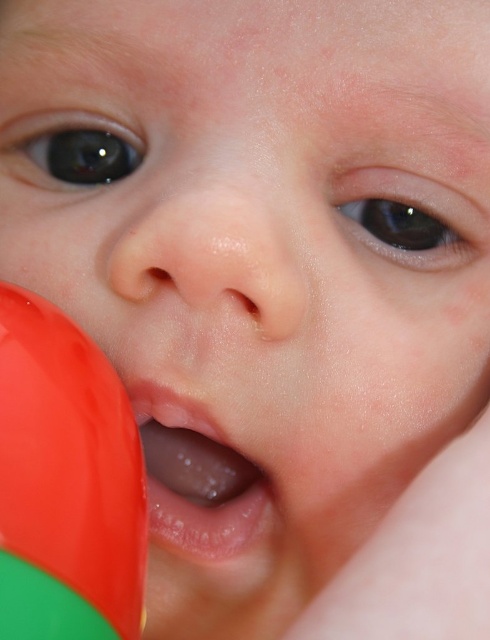
You are a photographer trying to capture a closeup of a baby. You need to ensure the baby is positioned so that the smooth skin nose at center is exactly 30 centimeters away from the camera lens. Currently, the baby is too close. How should you adjust the baby or the camera?

The smooth skin nose at center is currently 26.97 centimeters away from the camera. To achieve the desired 30 centimeters, you should move the baby or the camera back by approximately 3.03 centimeters.